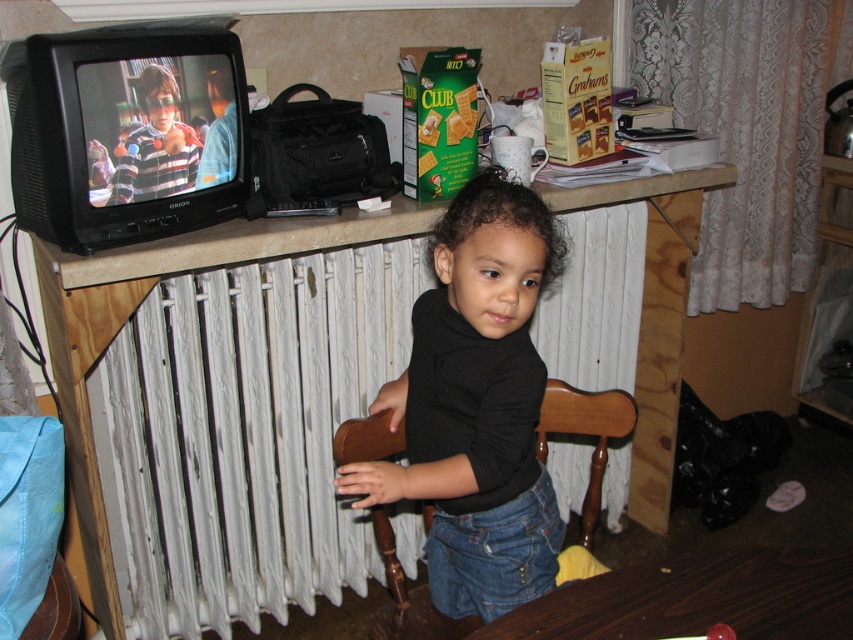
Question: Which object is the farthest from the white painted radiator at center?

Choices:
 (A) brown wooden chair at center
 (B) black matte shirt at center

Answer: (A)

Question: Does black matte shirt at center have a lesser width compared to dark wood table at lower center?

Choices:
 (A) yes
 (B) no

Answer: (A)

Question: Is black matte shirt at center to the left of dark wood table at lower center from the viewer's perspective?

Choices:
 (A) yes
 (B) no

Answer: (A)

Question: Which of the following is the farthest from the observer?

Choices:
 (A) (718, 560)
 (B) (485, 472)
 (C) (412, 627)

Answer: (C)

Question: Does white painted radiator at center appear on the right side of black matte shirt at center?

Choices:
 (A) yes
 (B) no

Answer: (B)

Question: Which of these objects is positioned closest to the white painted radiator at center?

Choices:
 (A) black matte shirt at center
 (B) dark wood table at lower center
 (C) brown wooden chair at center

Answer: (A)